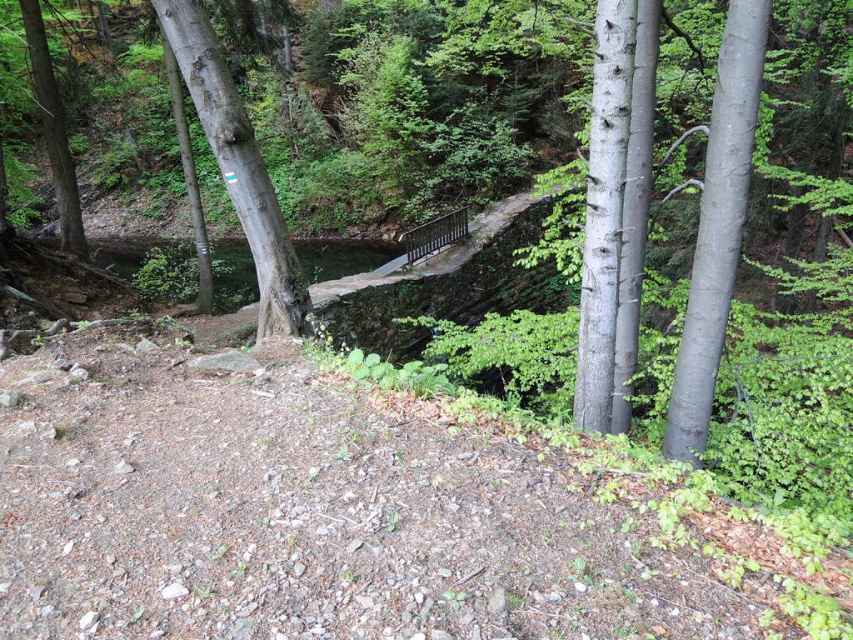
You are a hiker planning to tie a rope between the smooth gray tree at right and the green matte tree at left. Which tree has a thicker trunk to support the rope?

The green matte tree at left is thicker than the smooth gray tree at right, so it can better support the rope.

You are a hiker who wants to take a photo of both the smooth gray tree at right and the green matte tree at left. Since you want both trees to be fully visible in the frame, which tree should you stand closer to?

You should stand closer to the smooth gray tree at right because it is shorter than the green matte tree at left. By positioning yourself closer to the shorter tree, you can ensure both trees are fully visible in the camera frame without one being cut off.